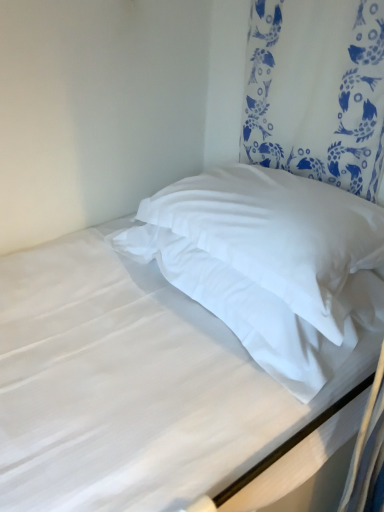
Question: Considering their positions, is white soft pillow at center, which appears as the 2th pillow when ordered from the bottom, located in front of or behind white smooth pillow at upper right?

Choices:
 (A) front
 (B) behind

Answer: (B)

Question: From the image's perspective, is white soft pillow at center, which appears as the 2th pillow when ordered from the bottom, above or below white smooth pillow at upper right?

Choices:
 (A) below
 (B) above

Answer: (B)

Question: Which is nearer to the white fabric curtain at upper right?

Choices:
 (A) white soft pillow at center, positioned as the 1th pillow in top-to-bottom order
 (B) white smooth pillow at upper right
 (C) white soft pillow at center, the second pillow positioned from the top

Answer: (A)

Question: Which object is positioned closest to the white fabric curtain at upper right?

Choices:
 (A) white soft pillow at center, which is the first pillow from bottom to top
 (B) white smooth pillow at upper right
 (C) white soft pillow at center, which appears as the 2th pillow when ordered from the bottom

Answer: (C)